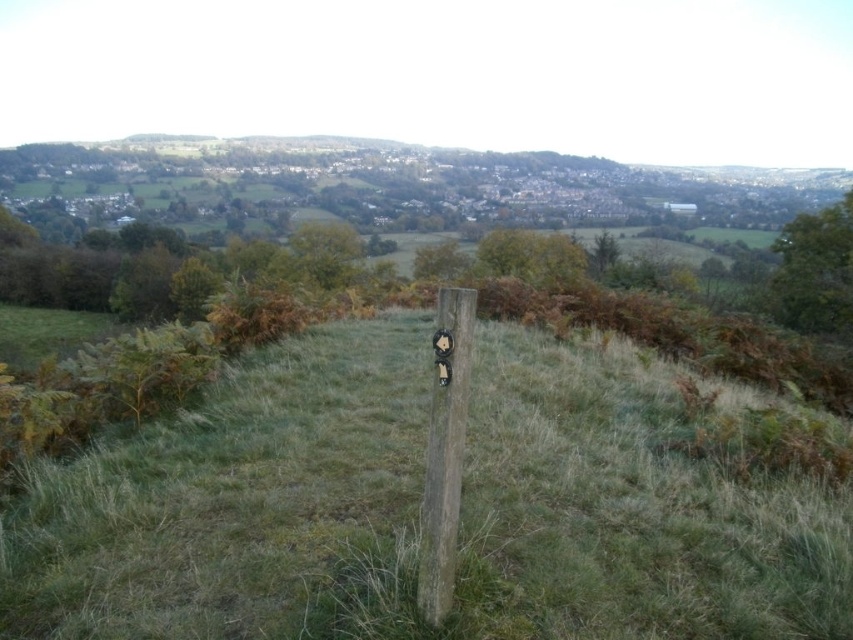
You are standing at the point marked by the wooden post with a circular sign. Looking out across the landscape, you notice a specific coordinate point labeled as point [241,506]. What type of terrain feature is located at that coordinate?

The point [241,506] corresponds to green grassy at center.